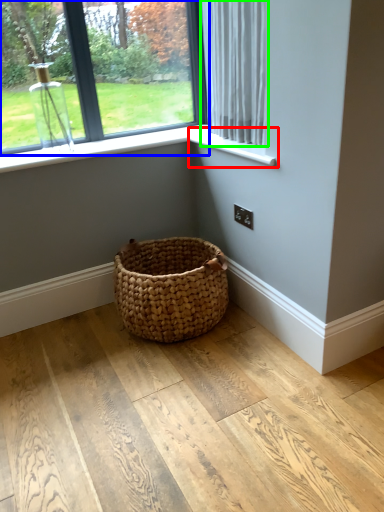
Question: Considering the real-world distances, which object is closest to window sill (highlighted by a red box)? window (highlighted by a blue box) or curtain (highlighted by a green box).

Choices:
 (A) window
 (B) curtain

Answer: (B)